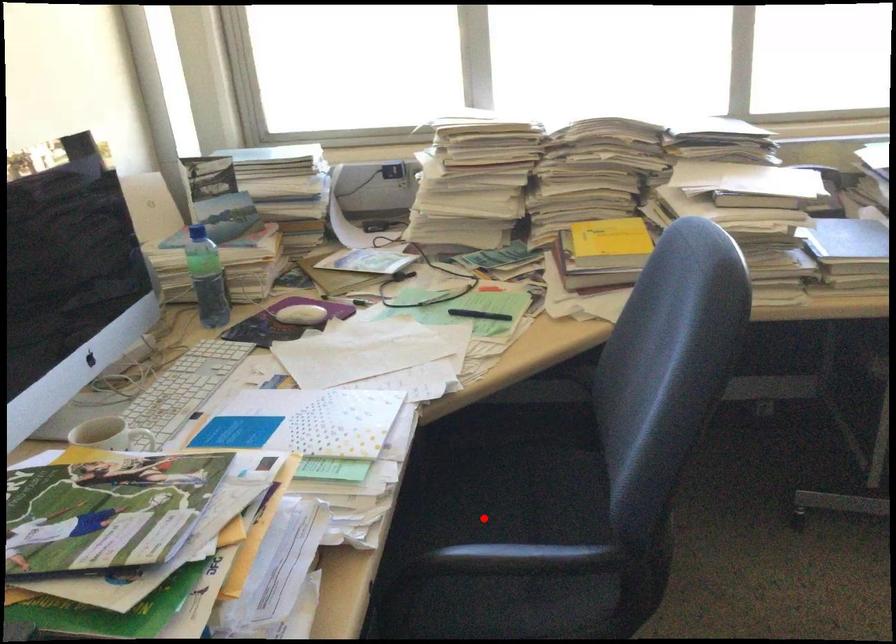
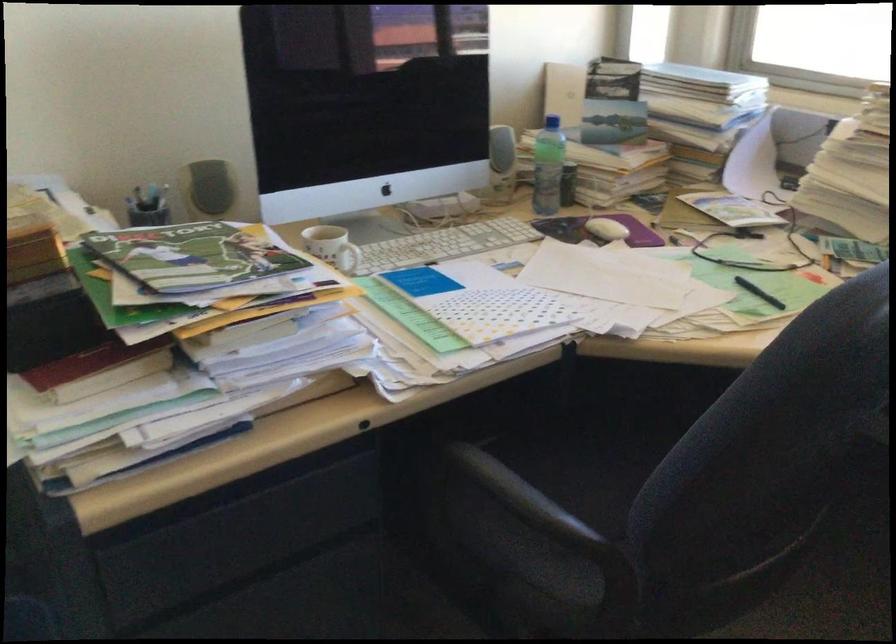
Where in the second image is the point corresponding to the highlighted location from the first image?

(616, 478)